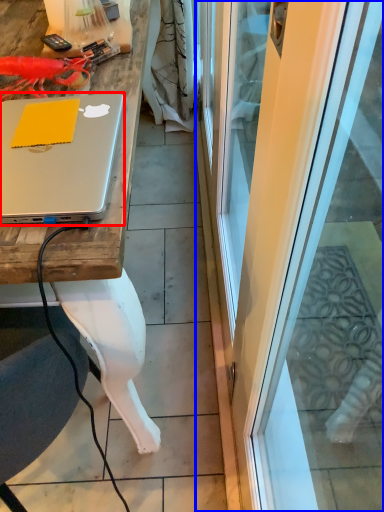
Question: Which point is further to the camera, laptop (highlighted by a red box) or screen door (highlighted by a blue box)?

Choices:
 (A) laptop
 (B) screen door

Answer: (A)